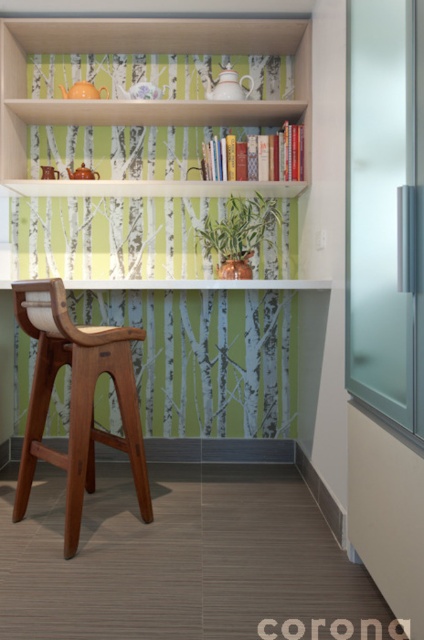
Question: Which point appears closest to the camera in this image?

Choices:
 (A) (298, 106)
 (B) (60, 456)
 (C) (225, 12)

Answer: (B)

Question: Is matte wood bookcase at upper center thinner than mahogany wood chair at center?

Choices:
 (A) no
 (B) yes

Answer: (A)

Question: Considering the real-world distances, which object is farthest from the white wood shelf at upper center?

Choices:
 (A) mahogany wood chair at center
 (B) matte wood bookcase at upper center

Answer: (A)

Question: From the image, what is the correct spatial relationship of matte wood bookcase at upper center in relation to mahogany wood chair at center?

Choices:
 (A) left
 (B) right

Answer: (B)

Question: Is matte wood bookcase at upper center behind mahogany wood chair at center?

Choices:
 (A) yes
 (B) no

Answer: (A)

Question: Which object appears closest to the camera in this image?

Choices:
 (A) mahogany wood chair at center
 (B) white wood shelf at upper center

Answer: (A)